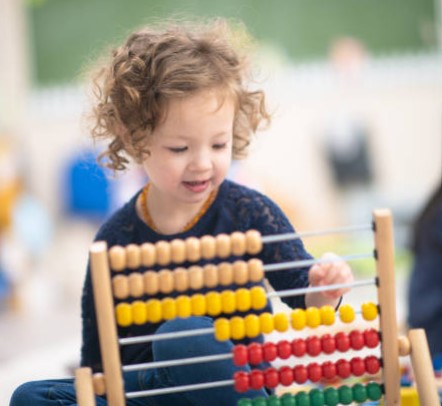
The image size is (442, 406). I want to click on abacus bead in fourth row down, so click(x=220, y=330), click(x=236, y=328), click(x=253, y=324), click(x=268, y=323), click(x=283, y=321), click(x=303, y=317), click(x=314, y=317), click(x=333, y=313), click(x=353, y=311), click(x=371, y=309).